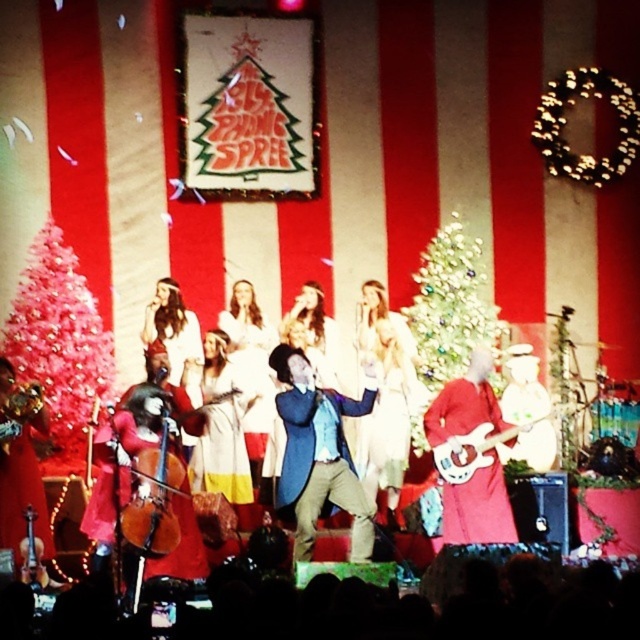
Which of these two, matte blue suit at center or red electric guitar at center, stands taller?

red electric guitar at center is taller.

Which is behind, point (307, 433) or point (508, 429)?

Positioned behind is point (307, 433).

Where is `matte blue suit at center`? matte blue suit at center is located at coordinates (317, 456).

Is green glittery christmas tree at center in front of red velvet guitar at center?

No.

Measure the distance between point (451, 216) and camera.

Point (451, 216) is 53.53 meters away from camera.

Locate an element on the screen. This screenshot has height=640, width=640. green glittery christmas tree at center is located at coordinates (449, 305).

Does velvet red cello at lower left appear over red velvet guitar at center?

No, velvet red cello at lower left is not above red velvet guitar at center.

Does velvet red cello at lower left have a greater width compared to red velvet guitar at center?

Yes.

Between point (144, 442) and point (493, 397), which one is positioned in front?

Point (144, 442) is more forward.

The width and height of the screenshot is (640, 640). I want to click on velvet red cello at lower left, so click(129, 451).